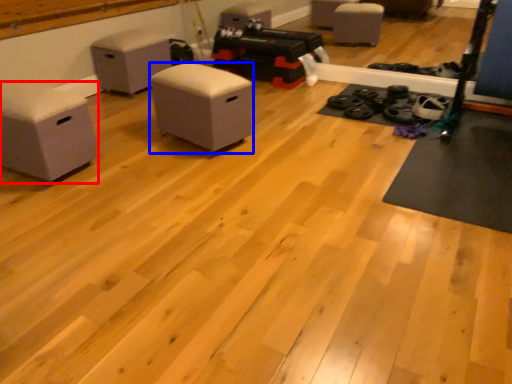
Question: Which object appears closest to the camera in this image, furniture (highlighted by a red box) or furniture (highlighted by a blue box)?

Choices:
 (A) furniture
 (B) furniture

Answer: (A)